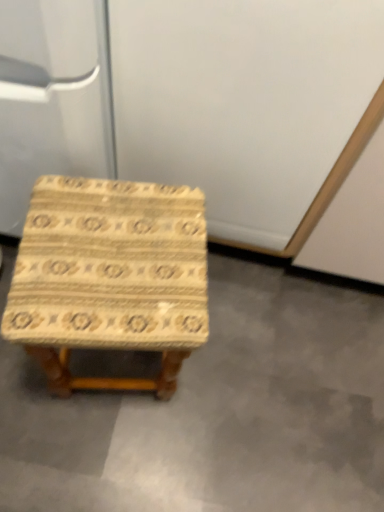
Image resolution: width=384 pixels, height=512 pixels. I want to click on blank area beneath wooden-patterned stool at center (from a real-world perspective), so click(116, 369).